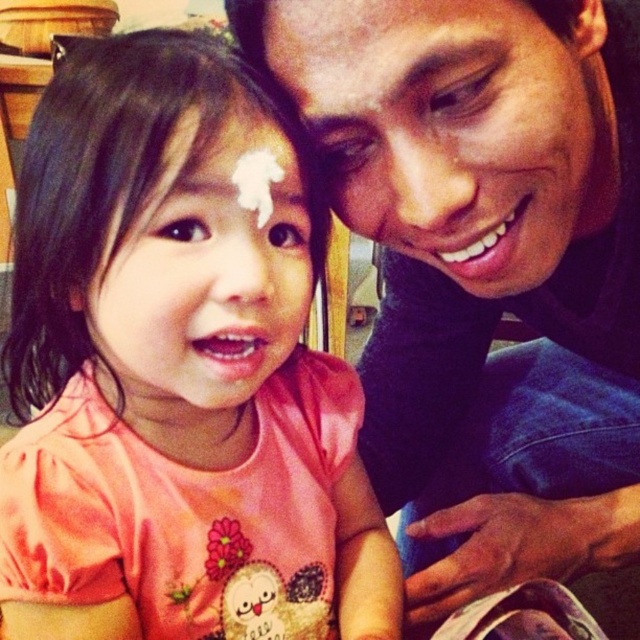
Is smooth skin face at upper right bigger than pink matte face at center?

Yes.

Between point (332, 147) and point (298, 316), which one is positioned in front?

Point (298, 316) is more forward.

Measure the distance between point [404,180] and camera.

17.54 inches

Identify the location of smooth skin face at upper right. This screenshot has height=640, width=640. (452, 125).

Is pink matte shirt at center wider than white sugar icing at center?

Correct, the width of pink matte shirt at center exceeds that of white sugar icing at center.

At what (x,y) coordinates should I click in order to perform the action: click on pink matte shirt at center. Please return your answer as a coordinate pair (x, y). This screenshot has width=640, height=640. Looking at the image, I should click on [x=177, y=372].

Locate an element on the screen. Image resolution: width=640 pixels, height=640 pixels. pink matte shirt at center is located at coordinates (177, 372).

Between point (145, 378) and point (458, 323), which one is positioned behind?

The point (458, 323) is more distant.

Does pink matte shirt at center have a lesser width compared to matte blue shirt at upper right?

Indeed, pink matte shirt at center has a lesser width compared to matte blue shirt at upper right.

Does point (253, 472) come in front of point (394, 92)?

That is False.

The image size is (640, 640). What are the coordinates of `pink matte shirt at center` in the screenshot? It's located at (177, 372).